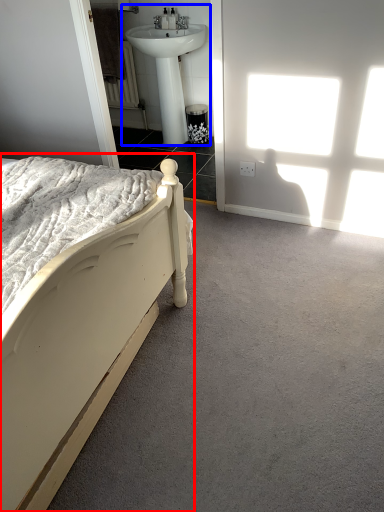
Question: Which point is further to the camera, bed (highlighted by a red box) or sink (highlighted by a blue box)?

Choices:
 (A) bed
 (B) sink

Answer: (B)